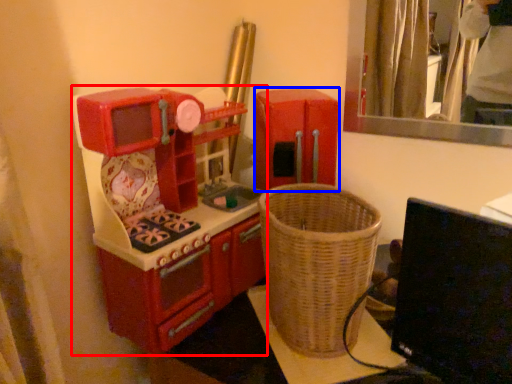
Question: Among these objects, which one is nearest to the camera, appliance (highlighted by a red box) or appliance (highlighted by a blue box)?

Choices:
 (A) appliance
 (B) appliance

Answer: (A)